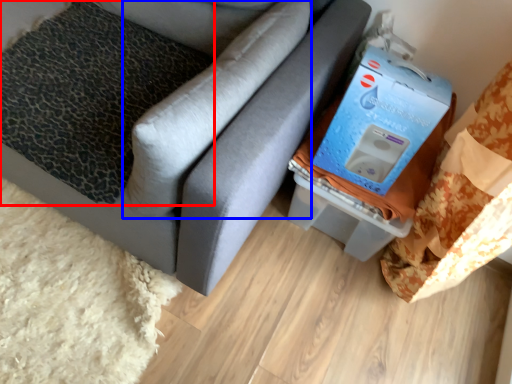
Question: Among these objects, which one is farthest to the camera, pillow (highlighted by a red box) or pillow (highlighted by a blue box)?

Choices:
 (A) pillow
 (B) pillow

Answer: (A)